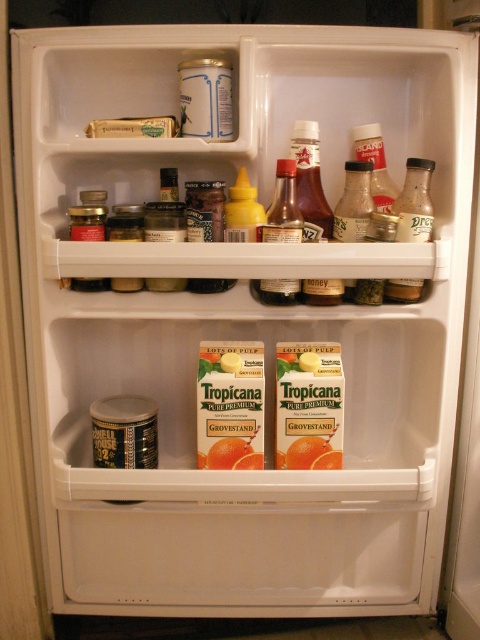
You are organizing the contents of the refrigerator and want to place the translucent plastic bottle at center and the orange matte carton at upper center on a shelf. Which item requires a taller space?

The translucent plastic bottle at center requires a taller space because it has a greater height compared to the orange matte carton at upper center.

You are organizing items in the fridge and need to place a new item between the translucent plastic bottle at center and the orange matte carton at upper center. Which item should you place the new item closer to to ensure it is in front of both?

You should place the new item closer to the translucent plastic bottle at center because it is already closer to the viewer than the orange matte carton at upper center, so positioning the new item near it will keep it in front of both.

You need to choose a taller bottle between the translucent plastic bottle at upper right and the translucent plastic bottle at center in the fridge. Which one should you pick?

The translucent plastic bottle at upper right is much taller than the translucent plastic bottle at center, so you should pick the translucent plastic bottle at upper right.